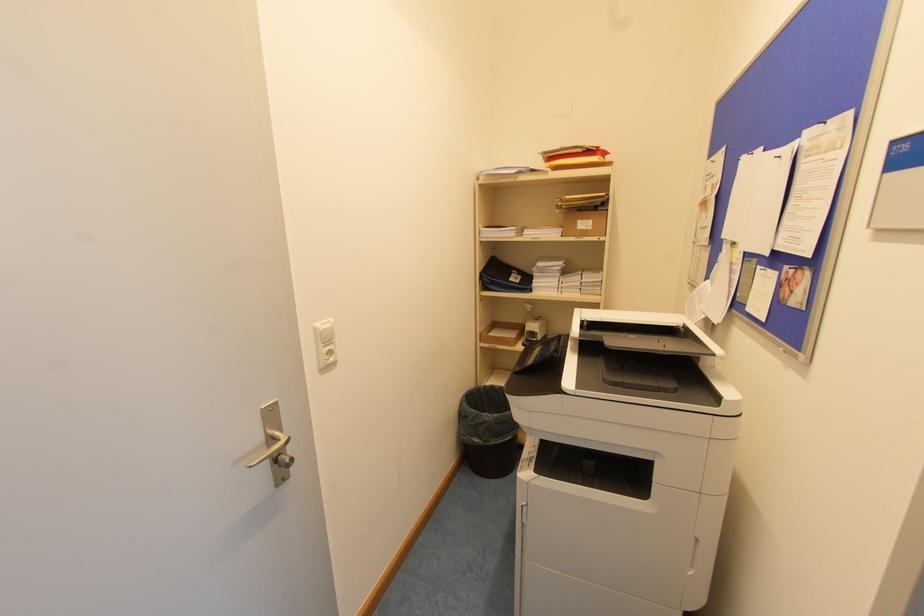
Image resolution: width=924 pixels, height=616 pixels. What do you see at coordinates (271, 447) in the screenshot?
I see `a metal door handle` at bounding box center [271, 447].